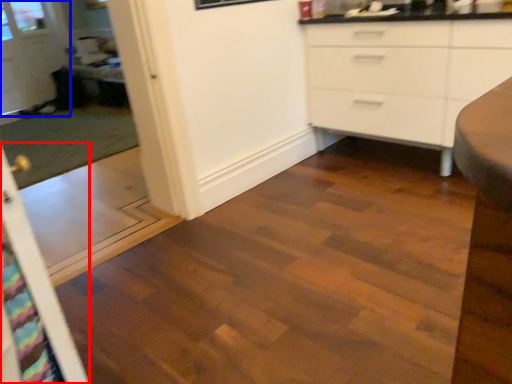
Question: Among these objects, which one is nearest to the camera, screen door (highlighted by a red box) or glass door (highlighted by a blue box)?

Choices:
 (A) screen door
 (B) glass door

Answer: (A)